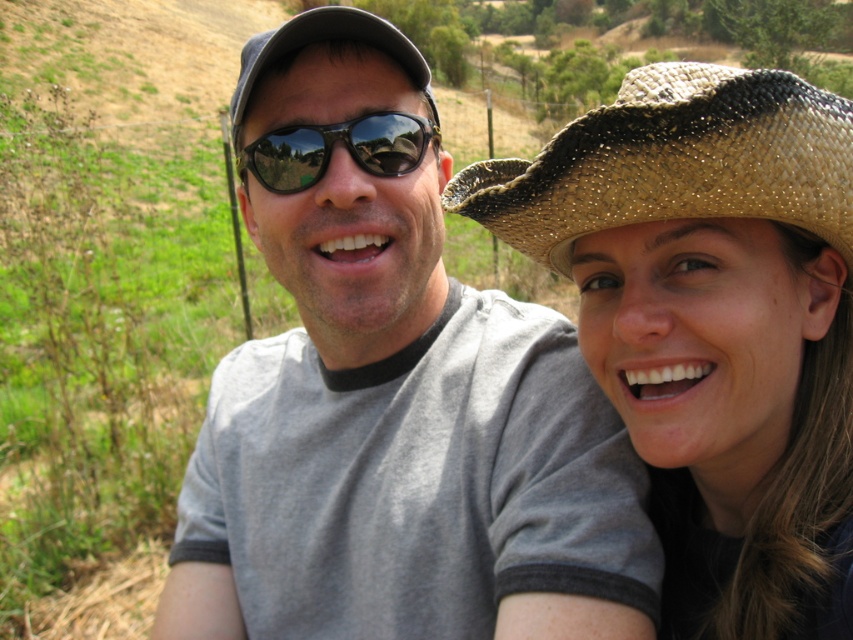
Question: Which object is the farthest from the black reflective sunglasses at center?

Choices:
 (A) natural straw hat at right
 (B) woven straw hat at upper right
 (C) gray t-shirt at center

Answer: (A)

Question: Which object is farther from the camera taking this photo?

Choices:
 (A) black reflective sunglasses at center
 (B) woven straw hat at upper right
 (C) natural straw hat at right

Answer: (A)

Question: Is natural straw hat at right in front of woven straw hat at upper right?

Choices:
 (A) no
 (B) yes

Answer: (B)

Question: Can you confirm if gray t-shirt at center is positioned above woven straw hat at upper right?

Choices:
 (A) yes
 (B) no

Answer: (B)

Question: Among these points, which one is nearest to the camera?

Choices:
 (A) (802, 209)
 (B) (241, 156)
 (C) (242, 104)

Answer: (A)

Question: Is gray t-shirt at center further to the viewer compared to natural straw hat at right?

Choices:
 (A) no
 (B) yes

Answer: (B)